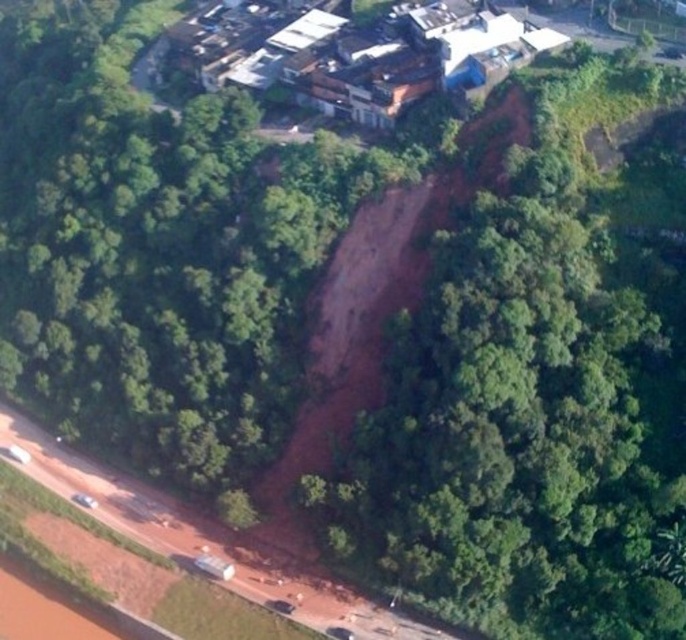
Between brown dirt cliff at center and brown wooden houses at upper center, which one appears on the right side from the viewer's perspective?

brown dirt cliff at center

Where is `brown dirt cliff at center`? brown dirt cliff at center is located at coordinates (539, 384).

Who is more forward, (544, 461) or (378, 92)?

Point (544, 461)

The height and width of the screenshot is (640, 686). Find the location of `brown dirt cliff at center`. brown dirt cliff at center is located at coordinates (539, 384).